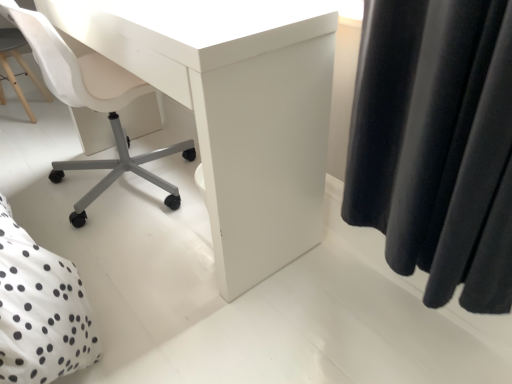
Question: Is the position of white dotted fabric at lower left less distant than that of white plastic chair at lower left?

Choices:
 (A) no
 (B) yes

Answer: (B)

Question: From a real-world perspective, is white dotted fabric at lower left over white plastic chair at lower left?

Choices:
 (A) no
 (B) yes

Answer: (B)

Question: Is white dotted fabric at lower left smaller than white plastic chair at lower left?

Choices:
 (A) yes
 (B) no

Answer: (A)

Question: From the image's perspective, is white dotted fabric at lower left beneath white plastic chair at lower left?

Choices:
 (A) no
 (B) yes

Answer: (B)

Question: Does white dotted fabric at lower left have a greater width compared to white plastic chair at lower left?

Choices:
 (A) yes
 (B) no

Answer: (A)

Question: From their relative heights in the image, would you say white dotted fabric at lower left is taller or shorter than white plastic chair at lower left?

Choices:
 (A) short
 (B) tall

Answer: (B)

Question: In terms of size, does white dotted fabric at lower left appear bigger or smaller than white plastic chair at lower left?

Choices:
 (A) small
 (B) big

Answer: (A)

Question: From the image's perspective, is white dotted fabric at lower left located above or below white plastic chair at lower left?

Choices:
 (A) above
 (B) below

Answer: (B)

Question: Considering their positions, is white dotted fabric at lower left located in front of or behind white plastic chair at lower left?

Choices:
 (A) front
 (B) behind

Answer: (A)

Question: From a real-world perspective, is white plastic chair at lower left positioned above or below white matte desk at center?

Choices:
 (A) above
 (B) below

Answer: (B)

Question: Is point [68, 96] closer or farther from the camera than point [324, 18]?

Choices:
 (A) farther
 (B) closer

Answer: (A)

Question: Is white plastic chair at lower left taller or shorter than white matte desk at center?

Choices:
 (A) tall
 (B) short

Answer: (A)

Question: From the image's perspective, is white plastic chair at lower left positioned above or below white matte desk at center?

Choices:
 (A) above
 (B) below

Answer: (A)

Question: Is white dotted fabric at lower left in front of or behind white matte desk at center in the image?

Choices:
 (A) front
 (B) behind

Answer: (A)

Question: Considering the relative positions of white dotted fabric at lower left and white matte desk at center in the image provided, is white dotted fabric at lower left to the left or to the right of white matte desk at center?

Choices:
 (A) right
 (B) left

Answer: (B)